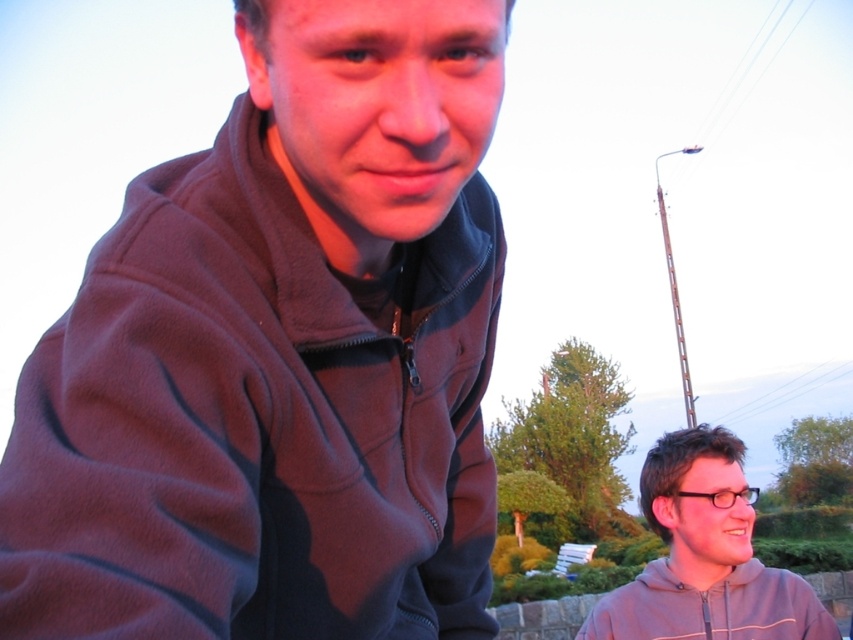
Question: Is gray matte hoodie at lower right in front of gray fleece sweatshirt at lower right?

Choices:
 (A) yes
 (B) no

Answer: (A)

Question: Is dark fleece jacket at upper left thinner than gray matte hoodie at lower right?

Choices:
 (A) yes
 (B) no

Answer: (A)

Question: Estimate the real-world distances between objects in this image. Which object is farther from the dark fleece jacket at upper left?

Choices:
 (A) gray matte hoodie at lower right
 (B) gray fleece sweatshirt at lower right

Answer: (B)

Question: Which point is closer to the camera taking this photo?

Choices:
 (A) (587, 620)
 (B) (751, 602)
 (C) (485, 451)

Answer: (C)

Question: Is dark fleece jacket at upper left behind gray matte hoodie at lower right?

Choices:
 (A) no
 (B) yes

Answer: (A)

Question: Estimate the real-world distances between objects in this image. Which object is farther from the dark fleece jacket at upper left?

Choices:
 (A) gray matte hoodie at lower right
 (B) gray fleece sweatshirt at lower right

Answer: (B)